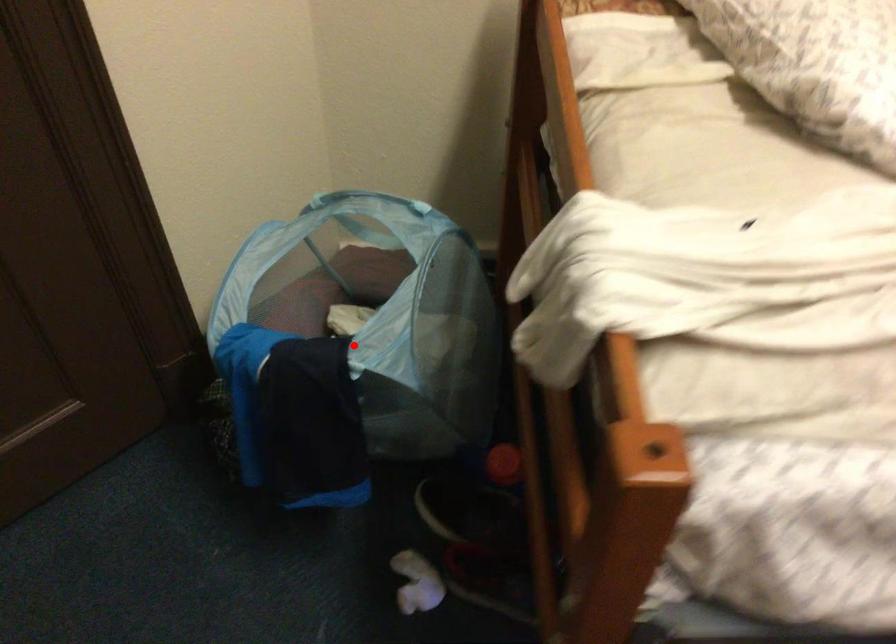
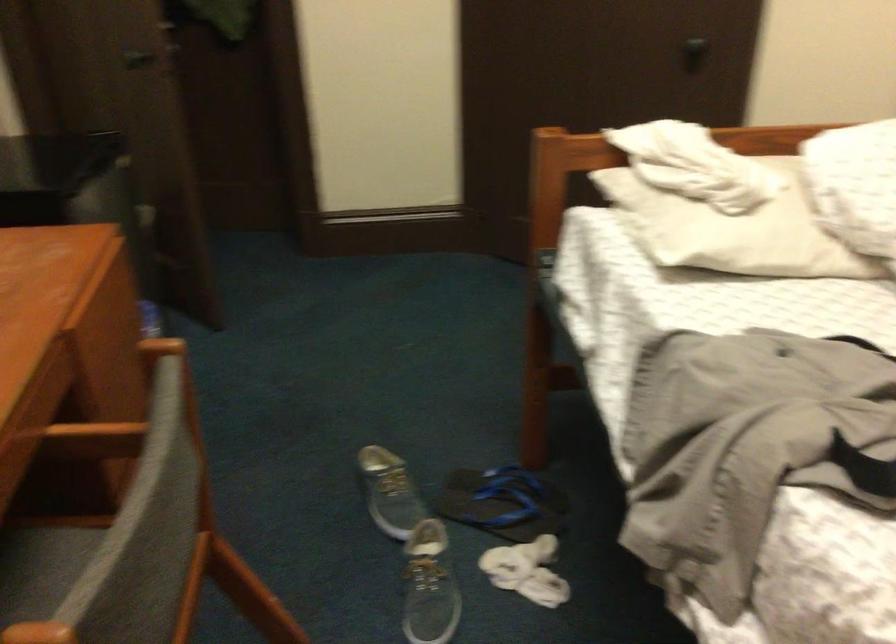
Question: I am providing you with two images of the same scene from different viewpoints. A red point is marked on the first image. At the location where the point appears in image 1, is it still visible in image 2?

Choices:
 (A) Yes
 (B) No

Answer: (B)